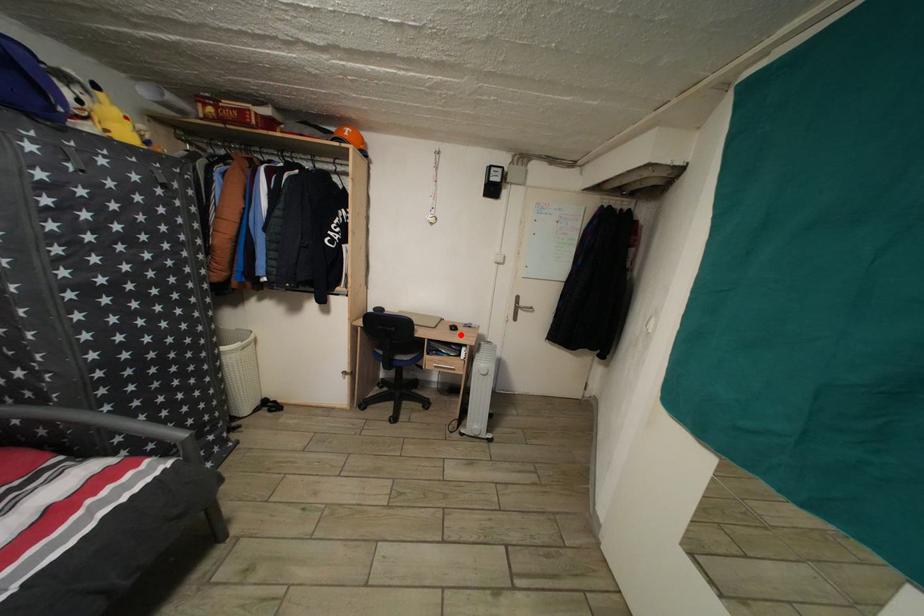
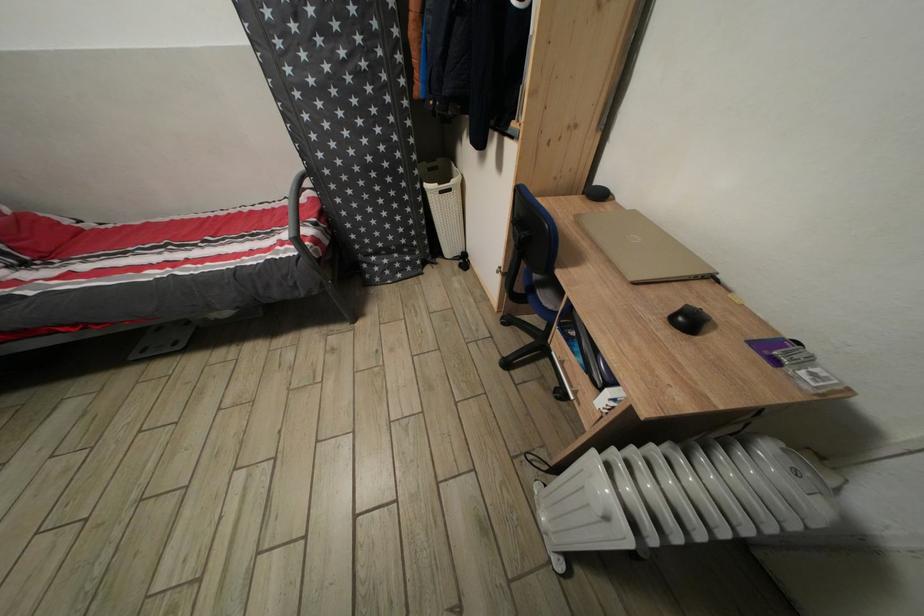
Where in the second image is the point corresponding to the highlighted location from the first image?

(696, 328)